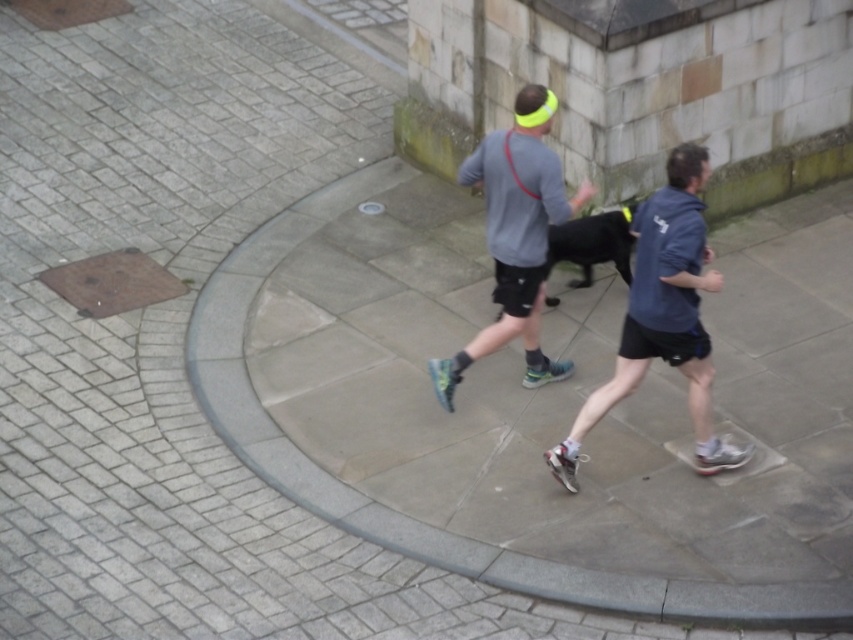
You are a photographer standing on the curved concrete path. You want to take a photo of both the blue fabric shirt at center and the gray matte shirt at center. Which one should you focus on first to ensure both are in sharp focus?

You should focus on the blue fabric shirt at center first because it is closer to the viewer than the gray matte shirt at center. By focusing on the closer subject, the farther one will also be in focus due to the depth of field.

You are a photographer standing at the starting point of the curved path. You want to capture a photo of the gray matte shirt at center and the black smooth dog at center. If the camera can only focus on one subject at a time, which subject should you choose to ensure the person appears larger in the photo?

The gray matte shirt at center is larger in size than the black smooth dog at center, so you should focus on the gray matte shirt at center to ensure the person appears larger in the photo.

You are a photographer standing at the starting point of the curved path. You want to capture a photo of the blue fabric shirt at center. Which direction should you face to ensure the shirt is in the frame?

The blue fabric shirt at center is located at point (x=663, y=316), which is near the center of the image. To capture it in the frame, you should face towards the center of the curved path where the shirt is positioned.